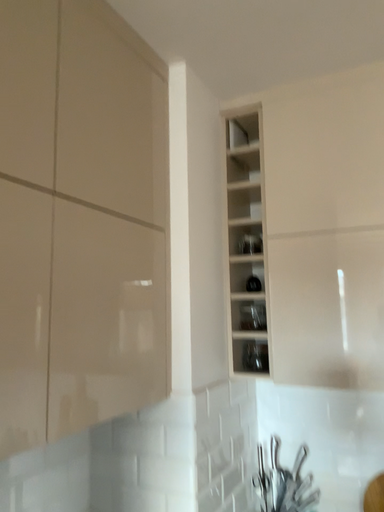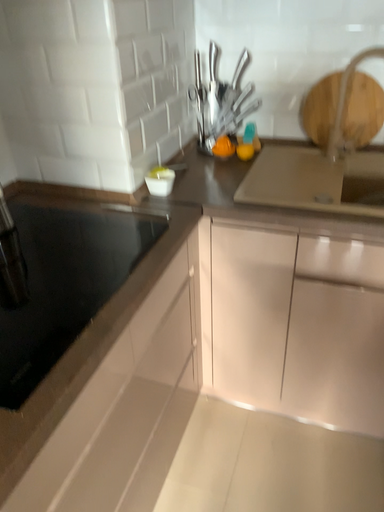
Question: How did the camera likely rotate when shooting the video?

Choices:
 (A) rotated left
 (B) rotated right

Answer: (B)